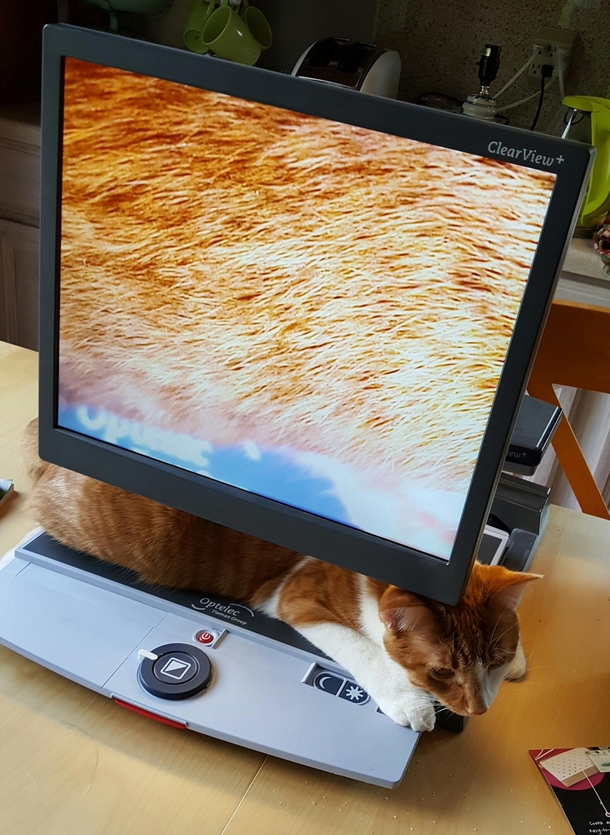
This screenshot has width=610, height=835. Identify the location of table. (571, 371).